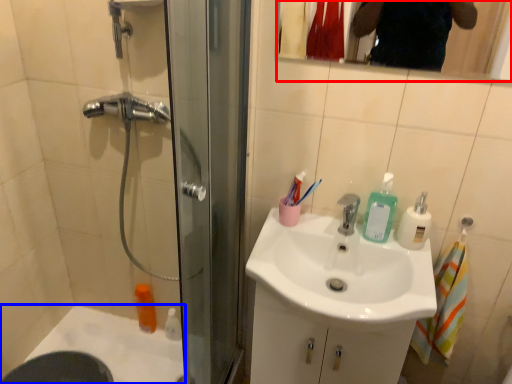
Question: Which object is further to the camera taking this photo, mirror (highlighted by a red box) or bath (highlighted by a blue box)?

Choices:
 (A) mirror
 (B) bath

Answer: (B)